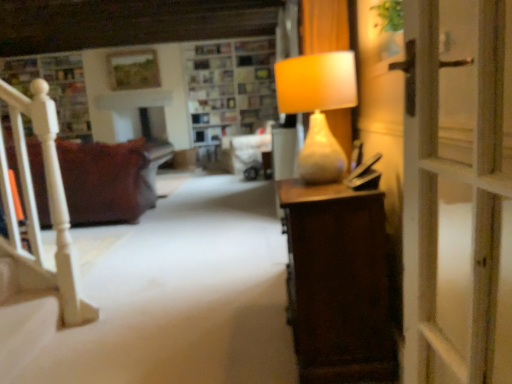
Question: Considering their positions, is matte beige lamp at right located in front of or behind brown fabric couch at left?

Choices:
 (A) front
 (B) behind

Answer: (A)

Question: From a real-world perspective, is matte beige lamp at right physically located above or below brown fabric couch at left?

Choices:
 (A) above
 (B) below

Answer: (A)

Question: Which object is the closest to the brown fabric couch at left?

Choices:
 (A) wooden shelves at upper center
 (B) matte beige lamp at right

Answer: (A)

Question: Which object is positioned closest to the brown fabric couch at left?

Choices:
 (A) wooden shelves at upper center
 (B) matte beige lamp at right

Answer: (A)